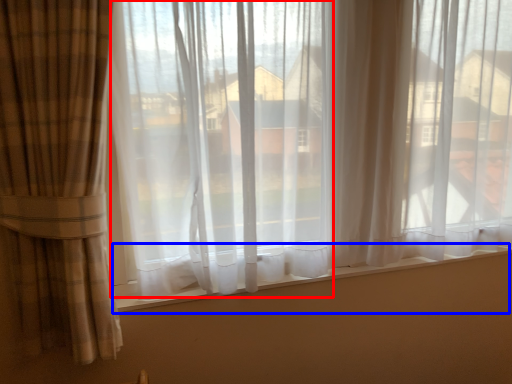
Question: Which object appears closest to the camera in this image, window screen (highlighted by a red box) or window sill (highlighted by a blue box)?

Choices:
 (A) window screen
 (B) window sill

Answer: (A)